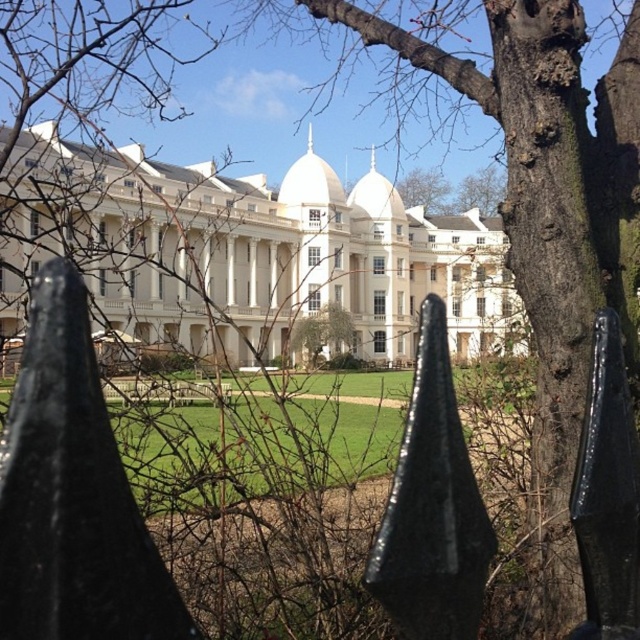
You are standing on the pathway leading to the grand building and want to take a photo of the green leafy tree at center without the black metal fence at center blocking the view. Which direction should you move to achieve this?

→ You should move to the right side of the pathway leading to the grand building. Since the black metal fence at center is to the left of the green leafy tree at center, moving right will position the fence behind you and keep the tree in clear view.

You are a photographer planning to take a picture of the grand white building with domes from the pathway. You notice the black metal fence at center and the green leafy tree at center might block the view. Which object is larger and could potentially block more of the building?

The black metal fence at center is bigger than the green leafy tree at center, so it would block more of the building.